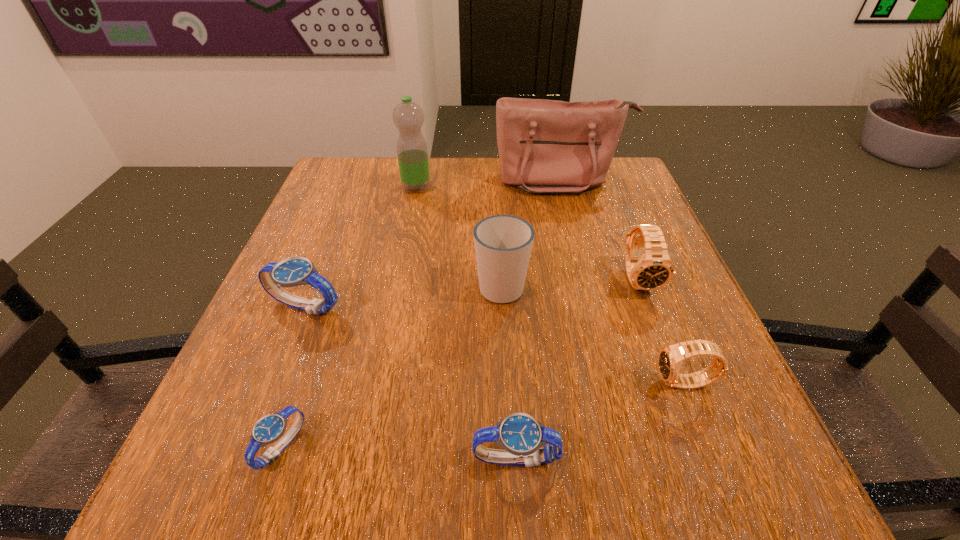
At what (x,y) coordinates should I click in order to perform the action: click on empty location between the fourth tallest object and the second shortest object. Please return your answer as a coordinate pair (x, y). The height and width of the screenshot is (540, 960). Looking at the image, I should click on (577, 369).

The height and width of the screenshot is (540, 960). What are the coordinates of `free point between the cup and the smaller black watch` in the screenshot? It's located at (593, 334).

This screenshot has width=960, height=540. I want to click on unoccupied area between the shoulder bag and the farthest blue watch, so click(433, 244).

I want to click on vacant area between the bigger black watch and the third watch from right to left, so click(577, 369).

Find the location of a particular element. The width and height of the screenshot is (960, 540). vacant area that lies between the cup and the nearer black watch is located at coordinates (593, 334).

The height and width of the screenshot is (540, 960). Find the location of `object that is the fifth closest one to the bigger black watch`. object that is the fifth closest one to the bigger black watch is located at coordinates (408, 117).

Identify which object is the second closest to the shoulder bag. Please provide its 2D coordinates. Your answer should be formatted as a tuple, i.e. [(x, y)], where the tuple contains the x and y coordinates of a point satisfying the conditions above.

[(652, 270)]

Locate an element on the screen. Image resolution: width=960 pixels, height=540 pixels. watch that is the closest to the white cup is located at coordinates (652, 270).

Point out which watch is positioned as the third nearest to the bigger black watch. Please provide its 2D coordinates. Your answer should be formatted as a tuple, i.e. [(x, y)], where the tuple contains the x and y coordinates of a point satisfying the conditions above.

[(294, 271)]

Select which blue watch is the second closest to the shortest object. Please provide its 2D coordinates. Your answer should be formatted as a tuple, i.e. [(x, y)], where the tuple contains the x and y coordinates of a point satisfying the conditions above.

[(520, 434)]